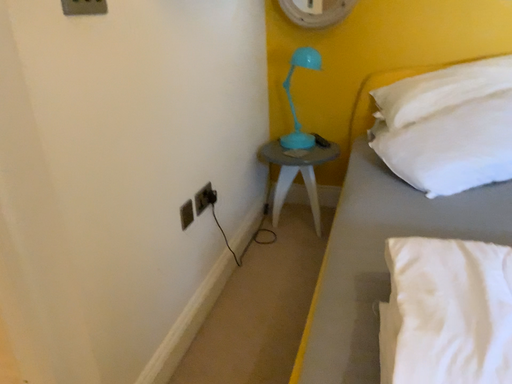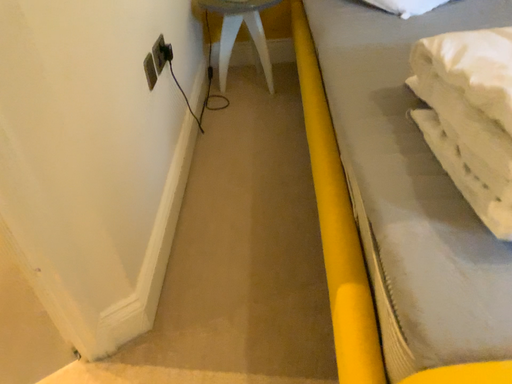
Question: How did the camera likely rotate when shooting the video?

Choices:
 (A) rotated upward
 (B) rotated downward

Answer: (B)